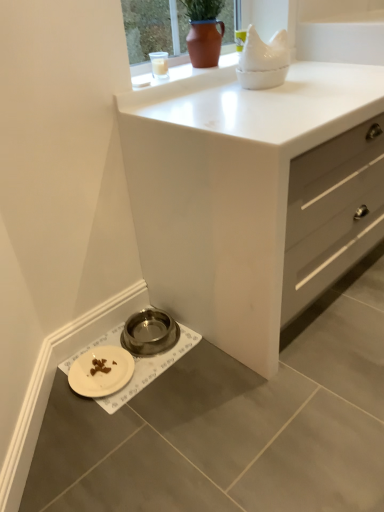
In order to click on vacant space underneath white matte plate at lower left (from a real-world perspective) in this screenshot , I will do `click(111, 373)`.